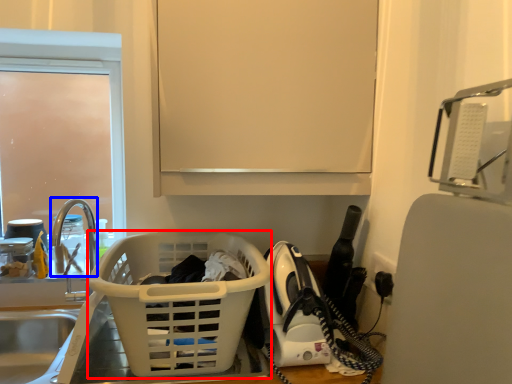
Question: Which point is closer to the camera, basket (highlighted by a red box) or faucet (highlighted by a blue box)?

Choices:
 (A) basket
 (B) faucet

Answer: (A)